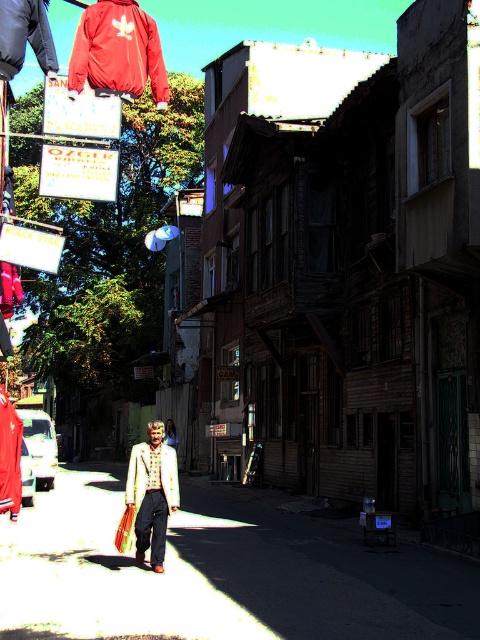
Question: Which object is closer to the camera taking this photo?

Choices:
 (A) white textured jacket at center
 (B) matte red jacket at upper left
 (C) matte beige dress at center

Answer: (A)

Question: Is white textured jacket at center above matte beige dress at center?

Choices:
 (A) yes
 (B) no

Answer: (A)

Question: Which point is farther to the camera?

Choices:
 (A) (168, 420)
 (B) (83, 17)
 (C) (84, 593)

Answer: (A)

Question: Is matte red jacket at upper left smaller than matte beige dress at center?

Choices:
 (A) yes
 (B) no

Answer: (B)

Question: Which point appears closest to the camera in this image?

Choices:
 (A) (139, 20)
 (B) (152, 464)
 (C) (168, 422)

Answer: (B)

Question: In this image, where is matte brown wooden alley at center located relative to matte red jacket at upper left?

Choices:
 (A) right
 (B) left

Answer: (A)